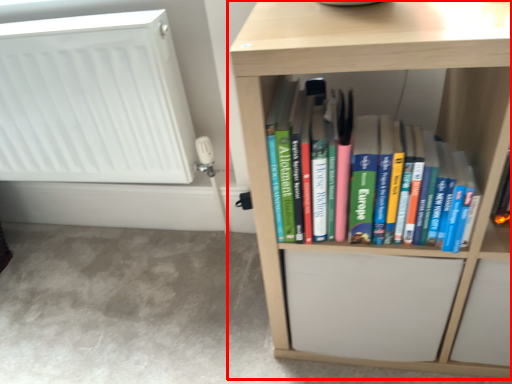
Question: Considering the relative positions of shelf (annotated by the red box) and radiator in the image provided, where is shelf (annotated by the red box) located with respect to the staircase?

Choices:
 (A) right
 (B) left

Answer: (A)